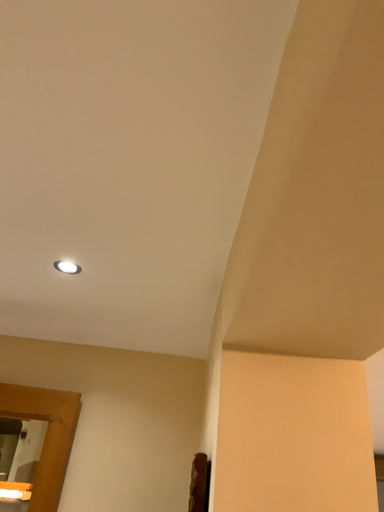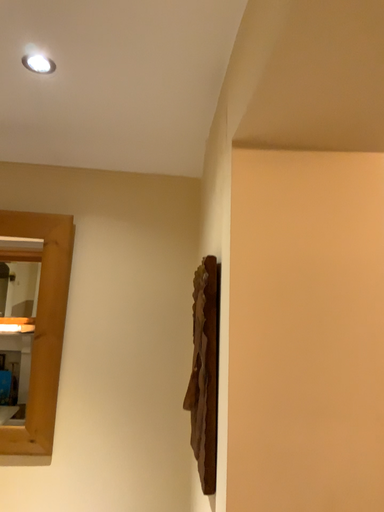
Question: Which way did the camera rotate in the video?

Choices:
 (A) rotated upward
 (B) rotated downward

Answer: (B)